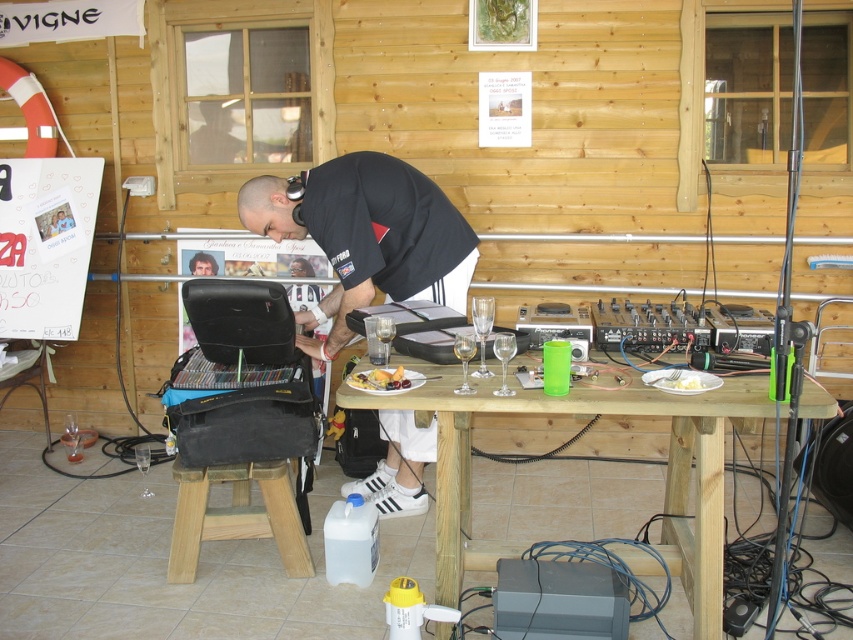
Question: Which object is closer to the camera taking this photo?

Choices:
 (A) wooden table at center
 (B) green plastic cup at table
 (C) wooden stool at lower left
 (D) smooth yellow cake at center

Answer: (A)

Question: Which point is farther to the camera?

Choices:
 (A) (296, 548)
 (B) (699, 387)
 (C) (405, 380)
 (D) (438, 483)

Answer: (A)

Question: Is wooden table at center in front of smooth yellow cake at center?

Choices:
 (A) no
 (B) yes

Answer: (B)

Question: Among these objects, which one is farthest from the camera?

Choices:
 (A) green plastic cup at table
 (B) smooth yellow cake at center
 (C) wooden stool at lower left
 (D) wooden table at center

Answer: (C)

Question: Can you confirm if wooden table at center is positioned above wooden stool at lower left?

Choices:
 (A) no
 (B) yes

Answer: (B)

Question: Can you confirm if wooden table at center is positioned below black matte shirt at center?

Choices:
 (A) no
 (B) yes

Answer: (B)